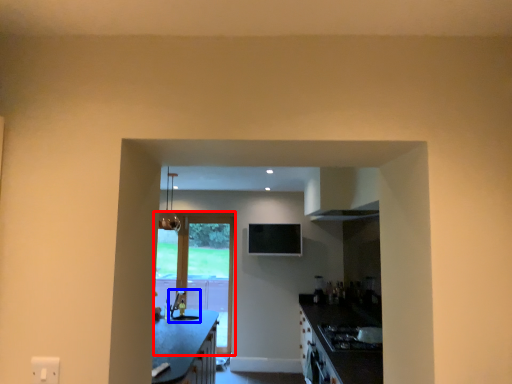
Question: Which point is closer to the camera, door (highlighted by a red box) or sink (highlighted by a blue box)?

Choices:
 (A) door
 (B) sink

Answer: (B)